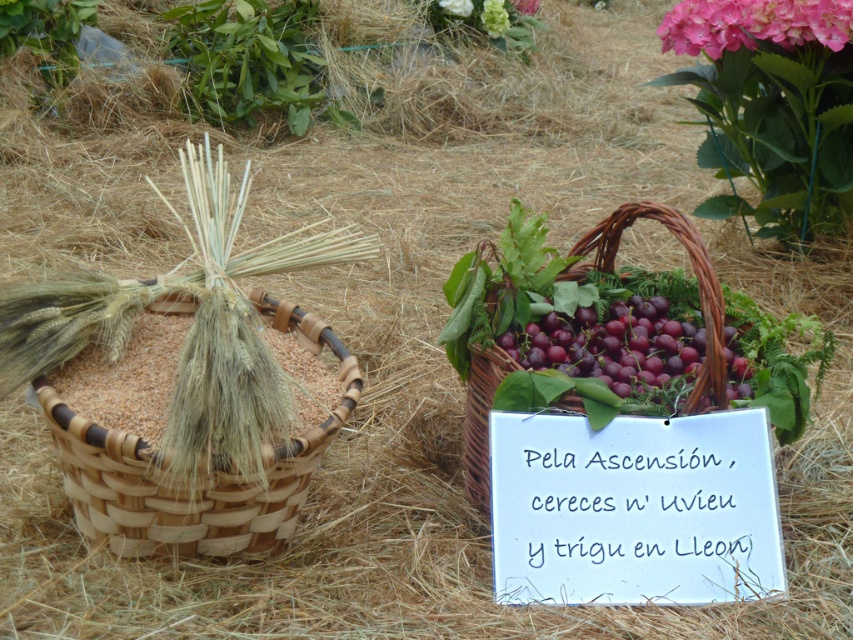
You are an artist setting up a still life. You have two items in front of you, the shiny purple grapes at center and the pink matte hydrangea at upper center. Which object should you place closer to the viewer to match the scene?

The shiny purple grapes at center should be placed closer to the viewer because it is in front of the pink matte hydrangea at upper center in the scene.

You are a farmer looking to place a new sign on the basket with grapes. The existing sign is at point (x=633, y=509). Where should you place the new sign to avoid overlapping?

The existing white paper sign at center is located at point (x=633, y=509), so place the new sign at a different coordinate to avoid overlapping.